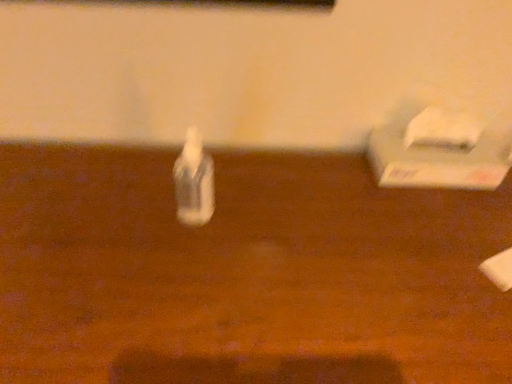
I want to click on vacant area situated to the left side of white matte tissue box at right, so click(x=332, y=190).